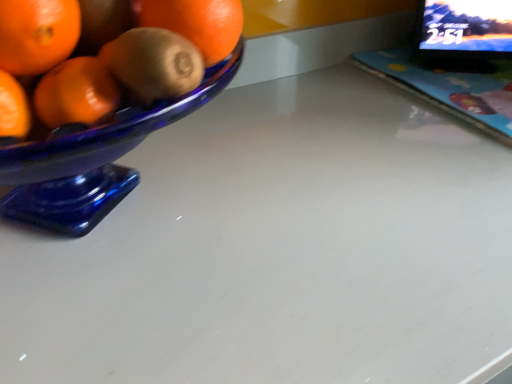
In order to click on vacant area on top of matte plastic laptop at upper right (from a real-world perspective) in this screenshot , I will do pos(449,73).